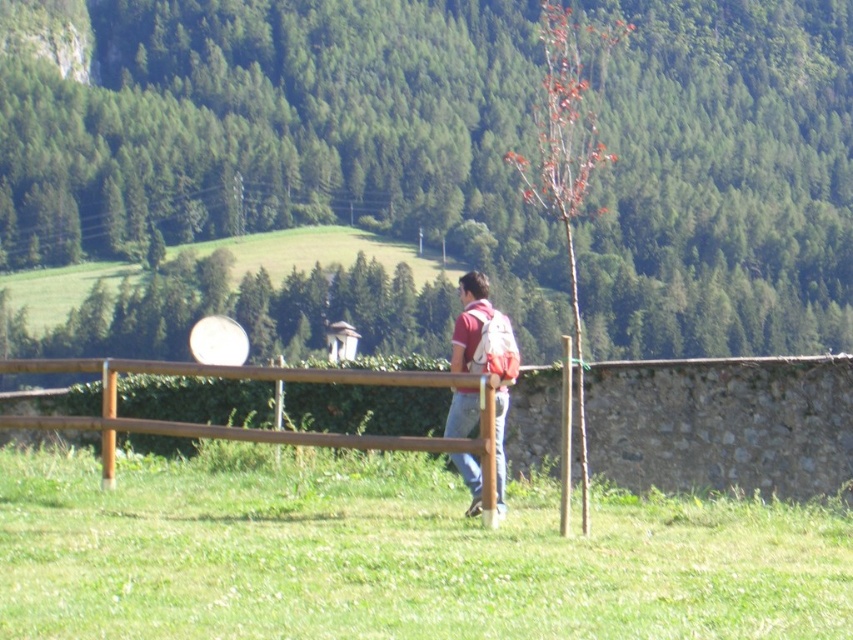
Question: Which point is farther to the camera?

Choices:
 (A) (830, 460)
 (B) (587, 49)
 (C) (821, 582)
 (D) (112, 140)

Answer: (B)

Question: Among these points, which one is farthest from the camera?

Choices:
 (A) (770, 483)
 (B) (457, 333)
 (C) (61, 538)

Answer: (A)

Question: Which point is closer to the camera?

Choices:
 (A) reddish-brown backpack at center
 (B) green grassy at center
 (C) green leafy tree at upper center
 (D) bark-like textured tree at center-right

Answer: (B)

Question: Does green grassy at center have a larger size compared to reddish-brown backpack at center?

Choices:
 (A) no
 (B) yes

Answer: (B)

Question: Is bark-like textured tree at center-right to the right of reddish-brown backpack at center from the viewer's perspective?

Choices:
 (A) yes
 (B) no

Answer: (A)

Question: Is green grassy at center positioned at the back of brown wooden fence at center?

Choices:
 (A) no
 (B) yes

Answer: (A)